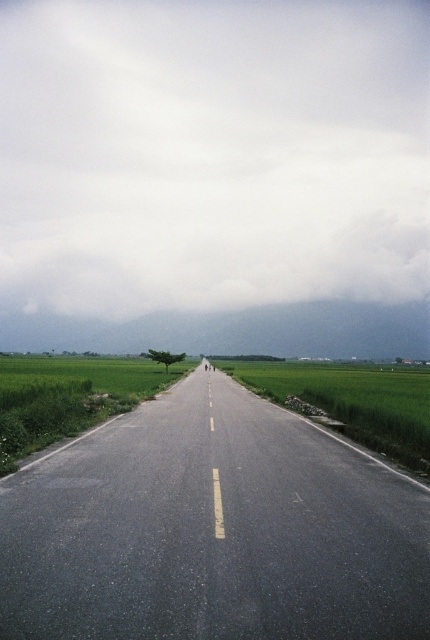
You are a drone operator trying to capture a photo of the white fluffy cloud at upper center and the asphalt road at center. Which object appears taller in the image?

The white fluffy cloud at upper center appears taller than the asphalt road at center in the image.

Consider the image. You are a drone operator trying to capture a photo of the white fluffy cloud at upper center and the green grassy rice field at center. Which object is higher in the image?

The white fluffy cloud at upper center is taller than the green grassy rice field at center, so the white fluffy cloud at upper center is higher in the image.

You are a bird soaring above the landscape. You see the white fluffy cloud at upper center and the green grass at center. Which one is bigger in size?

The white fluffy cloud at upper center is larger in size compared to the green grass at center.